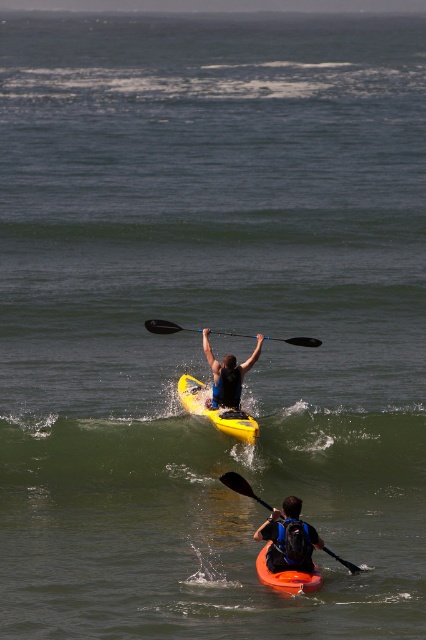
You are planning to kayak through the scene described. The green rubber wave at center and the orange matte canoe at lower center are in your path. Based on their sizes, can you safely navigate between them without touching either?

The green rubber wave at center might be wider than orange matte canoe at lower center, so there might not be enough space to safely navigate between them without touching either.

You are a photographer trying to capture the matte black backpack at lower center and the orange matte canoe at lower center in a single shot. Since you want the backpack to be the main focus, which object should you position closer to the camera lens?

The matte black backpack at lower center is already closer to the viewer than the orange matte canoe at lower center, so positioning it closer to the camera lens will keep it as the main focus.